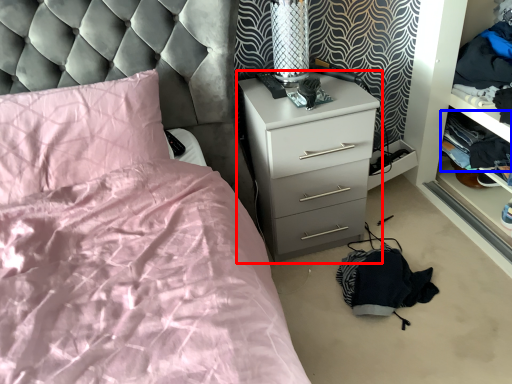
Question: Which object is further to the camera taking this photo, chest of drawers (highlighted by a red box) or clothing (highlighted by a blue box)?

Choices:
 (A) chest of drawers
 (B) clothing

Answer: (B)